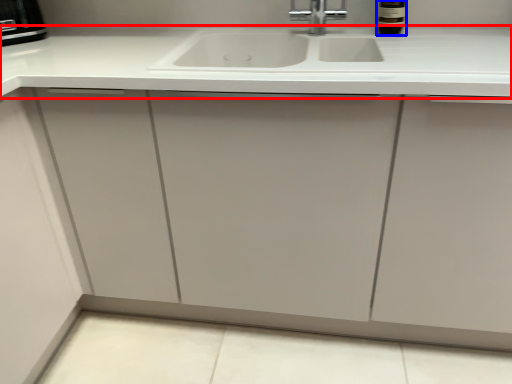
Question: Which object is further to the camera taking this photo, countertop (highlighted by a red box) or wine bottle (highlighted by a blue box)?

Choices:
 (A) countertop
 (B) wine bottle

Answer: (B)